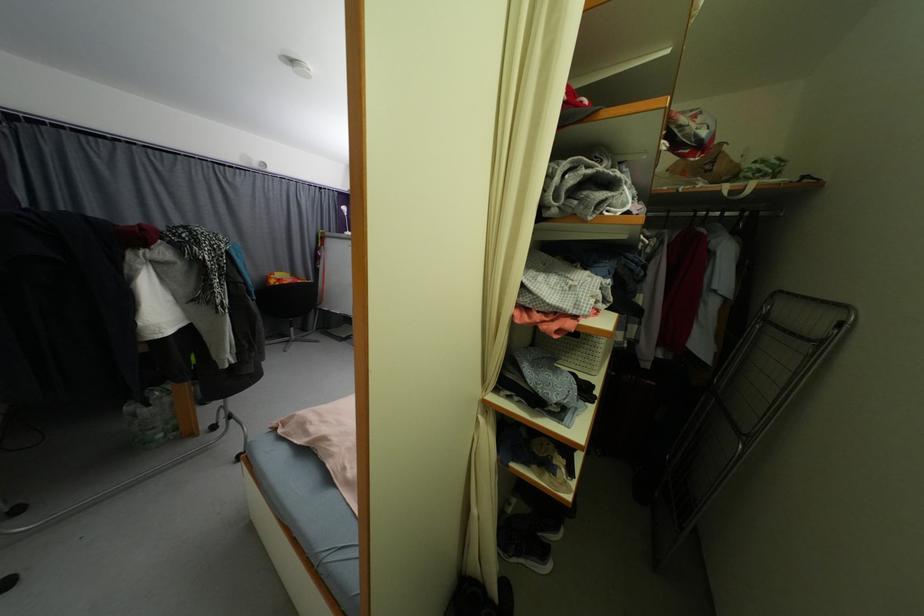
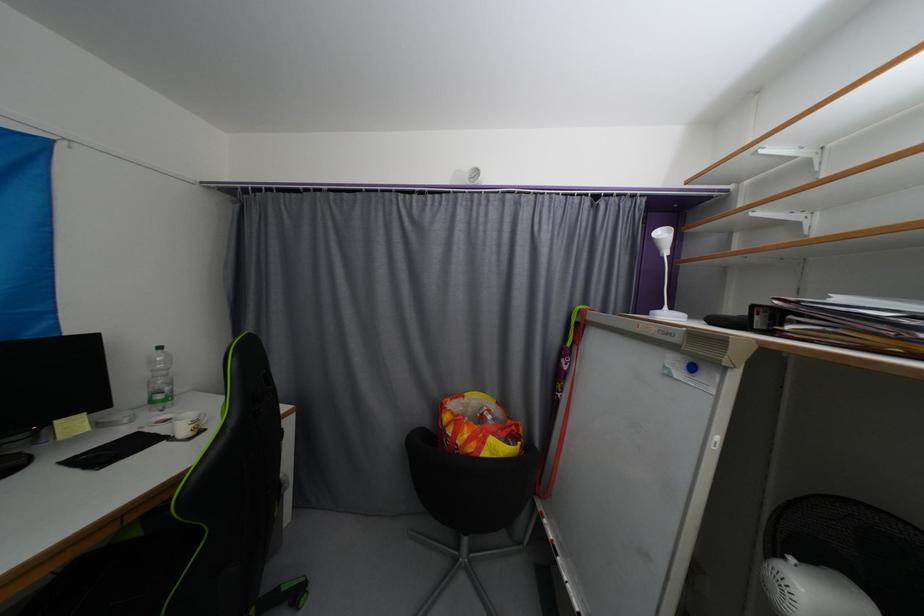
In the second image, find the point that corresponds to (354,235) in the first image.

(672, 317)